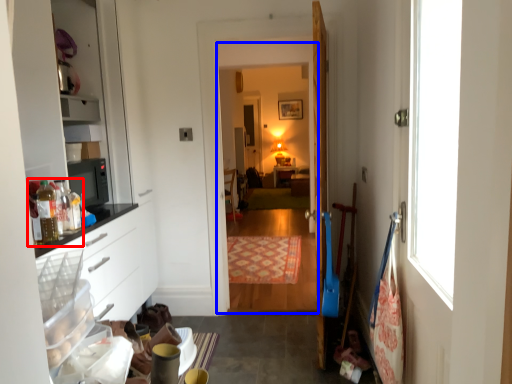
Question: Among these objects, which one is nearest to the camera, food (highlighted by a red box) or corridor (highlighted by a blue box)?

Choices:
 (A) food
 (B) corridor

Answer: (A)